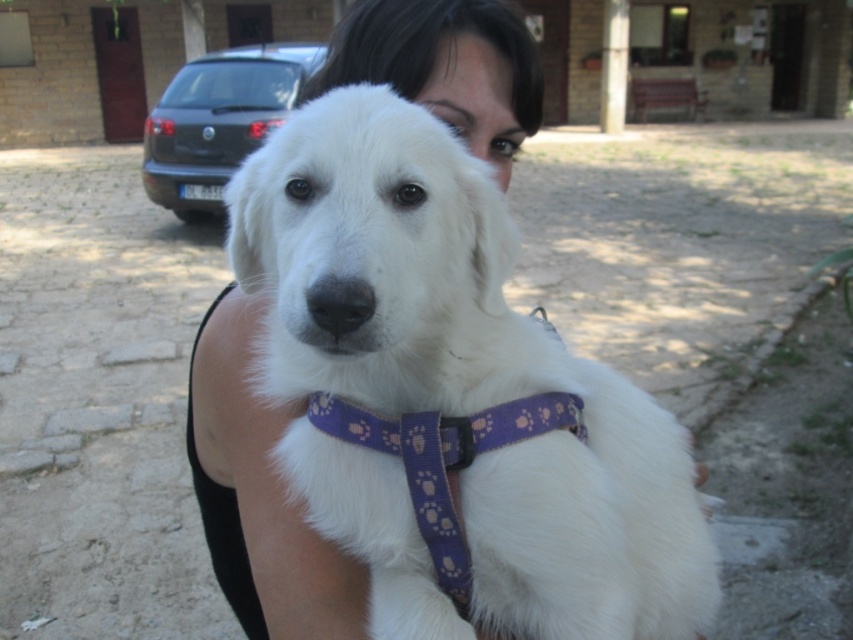
Question: Which object appears closest to the camera in this image?

Choices:
 (A) white fabric dog at center
 (B) purple fabric neckband at center

Answer: (A)

Question: From the image, what is the correct spatial relationship of white fabric dog at center in relation to purple fabric neckband at center?

Choices:
 (A) below
 (B) above

Answer: (B)

Question: Considering the relative positions of white fabric dog at center and purple fabric neckband at center in the image provided, where is white fabric dog at center located with respect to purple fabric neckband at center?

Choices:
 (A) right
 (B) left

Answer: (A)

Question: Which of the following is the closest to the observer?

Choices:
 (A) (421, 321)
 (B) (437, 438)

Answer: (A)

Question: Does white fabric dog at center come behind purple fabric neckband at center?

Choices:
 (A) yes
 (B) no

Answer: (B)